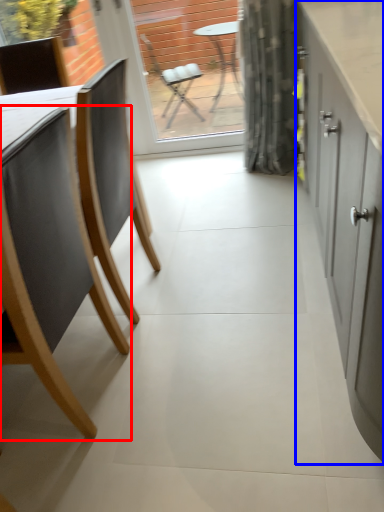
Question: Which object is closer to the camera taking this photo, chair (highlighted by a red box) or cabinetry (highlighted by a blue box)?

Choices:
 (A) chair
 (B) cabinetry

Answer: (B)